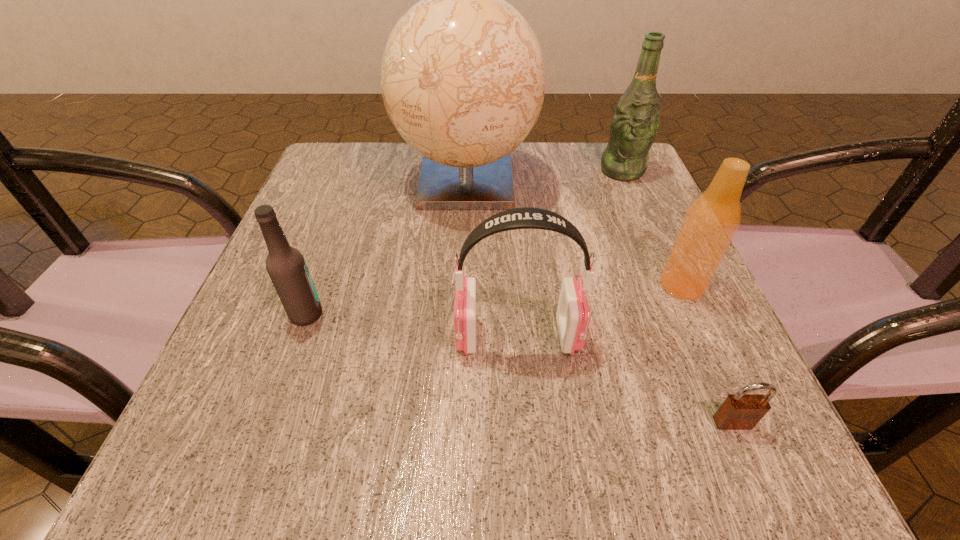
Where is `object that stands as the closest to the earphone`? Image resolution: width=960 pixels, height=540 pixels. object that stands as the closest to the earphone is located at coordinates (711, 221).

Select which object appears as the second closest to the third farthest object. Please provide its 2D coordinates. Your answer should be formatted as a tuple, i.e. [(x, y)], where the tuple contains the x and y coordinates of a point satisfying the conditions above.

[(740, 411)]

Identify the location of the closest beer bottle to the padlock. This screenshot has width=960, height=540. (711, 221).

Find the location of `beer bottle that is the second closest to the earphone`. beer bottle that is the second closest to the earphone is located at coordinates (286, 266).

What are the coordinates of `vacant space that satisfies the following two spatial constraints: 1. on the surface of the tallest object showing Europe and Africa; 2. on the label of the leftmost object` in the screenshot? It's located at (461, 314).

Locate an element on the screen. This screenshot has height=540, width=960. vacant region that satisfies the following two spatial constraints: 1. on the surface of the second tallest object; 2. on the outer surface of the earphone is located at coordinates (692, 336).

Where is `free location that satisfies the following two spatial constraints: 1. on the surface of the globe showing Europe and Africa; 2. on the label of the leftmost beer bottle`? The height and width of the screenshot is (540, 960). free location that satisfies the following two spatial constraints: 1. on the surface of the globe showing Europe and Africa; 2. on the label of the leftmost beer bottle is located at coordinates (461, 314).

Locate an element on the screen. The image size is (960, 540). free point that satisfies the following two spatial constraints: 1. on the surface of the tallest object showing Europe and Africa; 2. on the label of the nearest beer bottle is located at coordinates (461, 314).